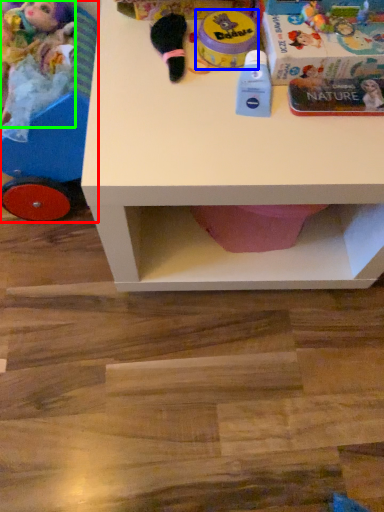
Question: Which object is positioned closest to toy (highlighted by a red box)? Select from toy (highlighted by a blue box) and toy (highlighted by a green box).

Choices:
 (A) toy
 (B) toy

Answer: (B)